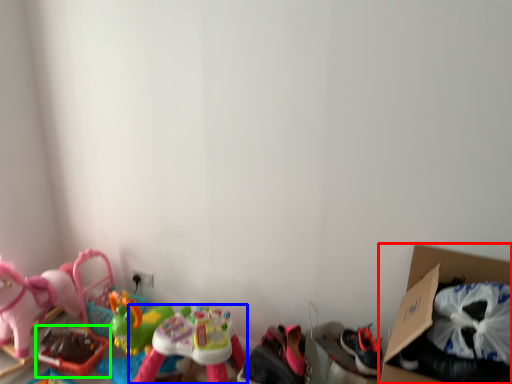
Question: Which object is the closest to the cardboard box (highlighted by a red box)? Choose among these: toy (highlighted by a blue box) or toy (highlighted by a green box).

Choices:
 (A) toy
 (B) toy

Answer: (A)